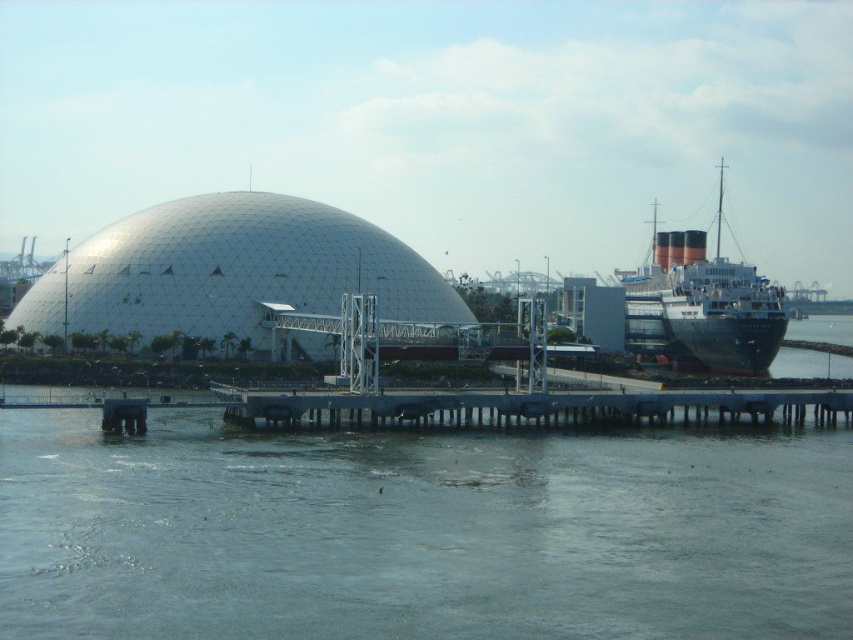
You are standing on the walkway leading to the geodesic dome and want to know which of the two points, point (299,609) or point (177,221), is closer to you. Can you determine this based on the scene?

Point (299,609) is closer to the viewer than point (177,221).

Looking at this image, you are a tourist standing on the walkway leading to the white geodesic dome at center. You want to take a photo of the black polished ship at right through the dome structure. Is the ship visible from your current position?

The white geodesic dome at center is below the black polished ship at right, so the ship is visible above the dome. You can take the photo as the ship is positioned higher than the dome.

You are a tourist standing on the blue metallic dock at center and want to take a photo of the black polished ship at right. Which direction should you face to capture both the ship and the walkway in the frame?

Since the blue metallic dock at center is below the black polished ship at right, you should face upward to include both the ship and the walkway in the frame.